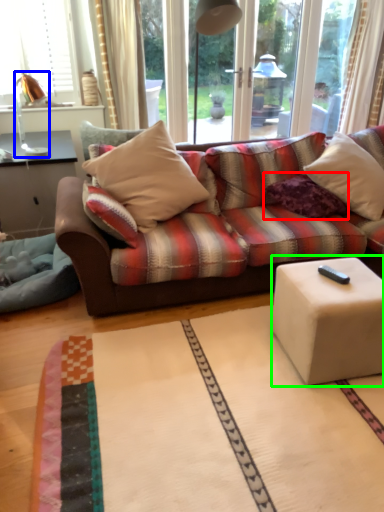
Question: Which object is positioned closest to pillow (highlighted by a red box)? Select from table lamp (highlighted by a blue box) and table (highlighted by a green box).

Choices:
 (A) table lamp
 (B) table

Answer: (B)